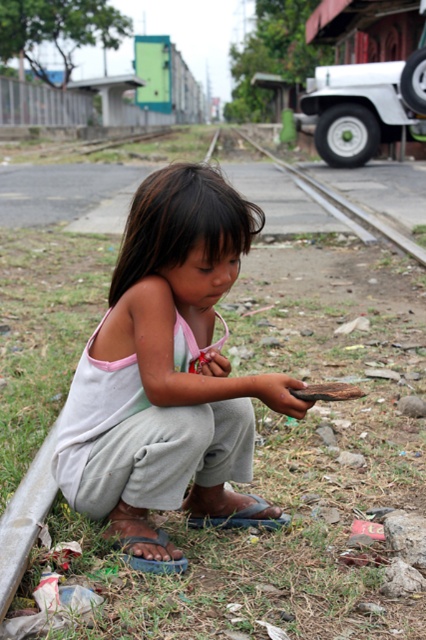
You are a safety officer observing the scene. The light gray cotton pants at center and the metal train track at center are in a critical location. Based on their positions, is there a potential safety hazard here?

The light gray cotton pants at center is positioned under the metal train track at center, indicating the child wearing the pants is near the tracks. This creates a safety hazard as the child is in close proximity to active railway tracks where trains might pass.